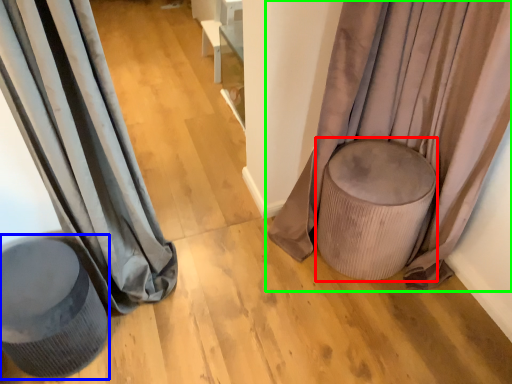
Question: Estimate the real-world distances between objects in this image. Which object is farther from music stool (highlighted by a red box), swivel chair (highlighted by a blue box) or curtain (highlighted by a green box)?

Choices:
 (A) swivel chair
 (B) curtain

Answer: (A)